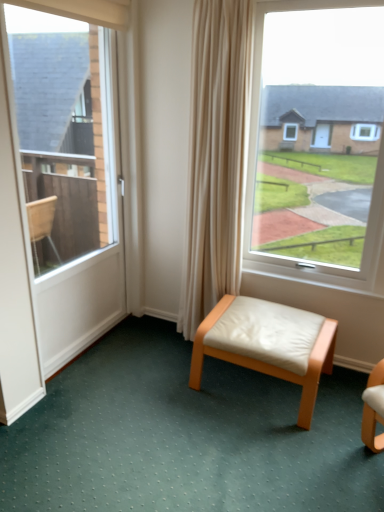
This screenshot has height=512, width=384. What are the coordinates of `free area in between white leather stool at center and white glossy door at left` in the screenshot? It's located at (158, 368).